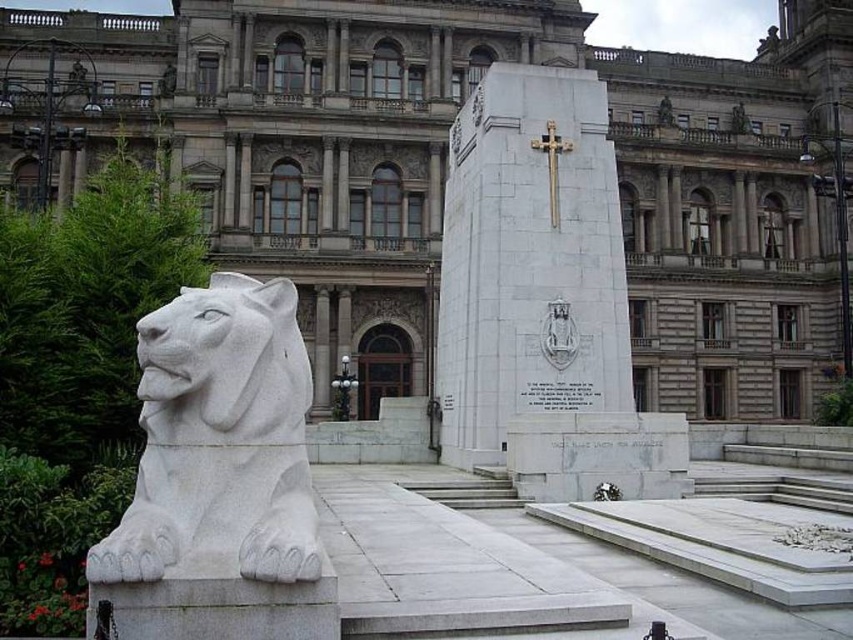
Can you confirm if white marble monument at center is positioned below white stone lion at left?

No, white marble monument at center is not below white stone lion at left.

Does point (540, 147) come behind point (213, 428)?

That is True.

Identify the location of white marble monument at center. The width and height of the screenshot is (853, 640). (543, 298).